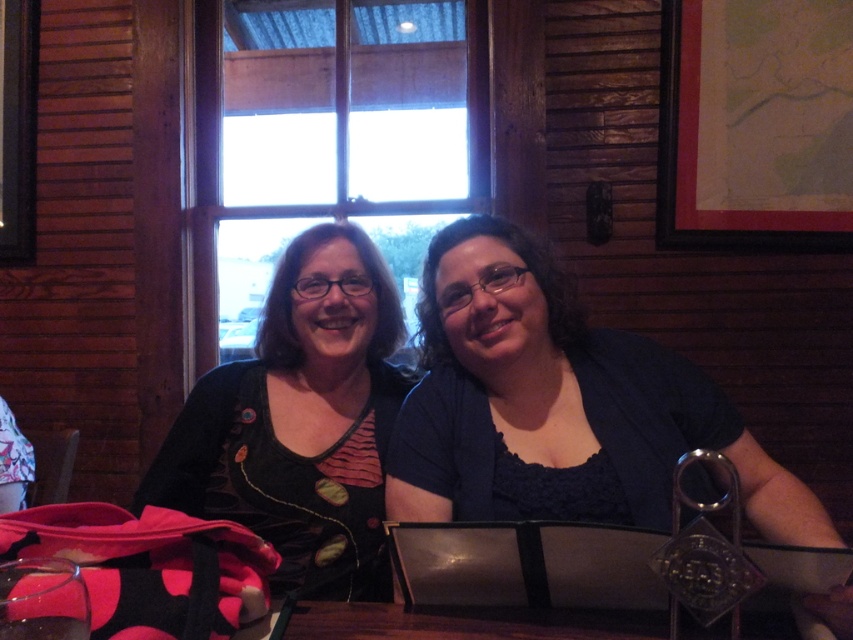
You are a photographer trying to capture a clear shot of both the black velvet shirt at center and the transparent glass at lower left. Which object should you focus on first to ensure it appears sharp in the photo?

You should focus on the black velvet shirt at center first because it is closer to the viewer than the transparent glass at lower left, ensuring it remains sharp while the glass may appear slightly out of focus if not adjusted.

Please look at the coordinates point given in the image. What is the object located at point (560, 404)?

The object located at point (560, 404) is the dark blue fabric shirt at center.

You are a photographer trying to capture a closeup of the dark blue fabric shirt at center and the transparent glass at lower left. Since you can only focus on one object at a time, which object should you choose to ensure it fills most of your camera frame?

The dark blue fabric shirt at center is larger in size than the transparent glass at lower left, so focusing on it will fill the frame more effectively.